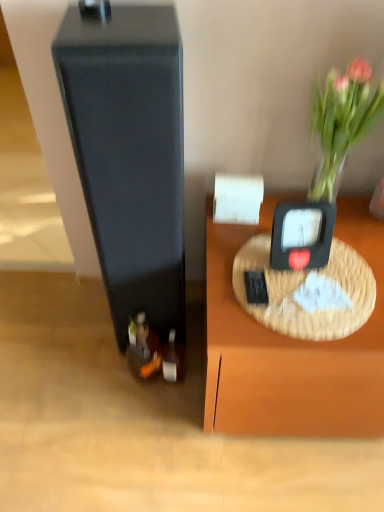
Question: Should I look upward or downward to see black plastic weight scale at upper right?

Choices:
 (A) up
 (B) down

Answer: (A)

Question: Considering the relative sizes of shiny silver wine bottle at lower center, marked as the 1th wine bottle in a right-to-left arrangement, and shiny dark glass wine bottle at lower left, which is the 2th wine bottle from right to left, in the image provided, is shiny silver wine bottle at lower center, marked as the 1th wine bottle in a right-to-left arrangement, smaller than shiny dark glass wine bottle at lower left, which is the 2th wine bottle from right to left,?

Choices:
 (A) yes
 (B) no

Answer: (A)

Question: From a real-world perspective, is shiny silver wine bottle at lower center, which is the second wine bottle in left-to-right order, physically above shiny dark glass wine bottle at lower left, the 1th wine bottle viewed from the left?

Choices:
 (A) yes
 (B) no

Answer: (B)

Question: Does shiny silver wine bottle at lower center, which is the second wine bottle in left-to-right order, have a lesser width compared to shiny dark glass wine bottle at lower left, which is the 2th wine bottle from right to left?

Choices:
 (A) no
 (B) yes

Answer: (B)

Question: Would you say shiny silver wine bottle at lower center, which is the second wine bottle in left-to-right order, is a long distance from shiny dark glass wine bottle at lower left, which is the 2th wine bottle from right to left?

Choices:
 (A) no
 (B) yes

Answer: (A)

Question: Is shiny silver wine bottle at lower center, which is the second wine bottle in left-to-right order, outside of shiny dark glass wine bottle at lower left, the 1th wine bottle viewed from the left?

Choices:
 (A) no
 (B) yes

Answer: (B)

Question: From a real-world perspective, is shiny silver wine bottle at lower center, which is the second wine bottle in left-to-right order, physically below shiny dark glass wine bottle at lower left, which is the 2th wine bottle from right to left?

Choices:
 (A) no
 (B) yes

Answer: (B)

Question: Is shiny silver wine bottle at lower center, which is the second wine bottle in left-to-right order, oriented away from black plastic weight scale at upper right?

Choices:
 (A) yes
 (B) no

Answer: (B)

Question: From a real-world perspective, is shiny silver wine bottle at lower center, marked as the 1th wine bottle in a right-to-left arrangement, positioned over black plastic weight scale at upper right based on gravity?

Choices:
 (A) no
 (B) yes

Answer: (A)

Question: Can you confirm if shiny silver wine bottle at lower center, which is the second wine bottle in left-to-right order, is taller than black plastic weight scale at upper right?

Choices:
 (A) yes
 (B) no

Answer: (A)

Question: Can you confirm if shiny silver wine bottle at lower center, which is the second wine bottle in left-to-right order, is positioned to the left of black plastic weight scale at upper right?

Choices:
 (A) yes
 (B) no

Answer: (A)

Question: Is shiny silver wine bottle at lower center, which is the second wine bottle in left-to-right order, smaller than black plastic weight scale at upper right?

Choices:
 (A) yes
 (B) no

Answer: (A)

Question: Considering the relative sizes of shiny silver wine bottle at lower center, marked as the 1th wine bottle in a right-to-left arrangement, and black plastic weight scale at upper right in the image provided, is shiny silver wine bottle at lower center, marked as the 1th wine bottle in a right-to-left arrangement, thinner than black plastic weight scale at upper right?

Choices:
 (A) no
 (B) yes

Answer: (B)

Question: Could you tell me if translucent glass vase at upper right is turned towards shiny dark glass wine bottle at lower left, the 1th wine bottle viewed from the left?

Choices:
 (A) yes
 (B) no

Answer: (B)